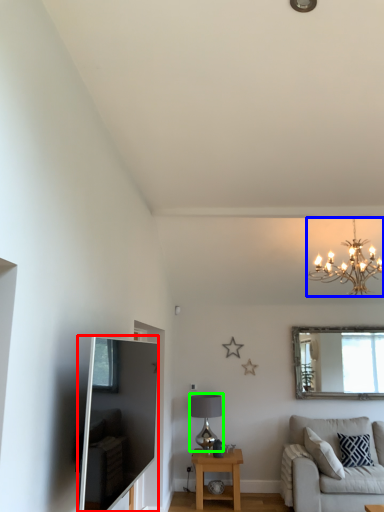
Question: Estimate the real-world distances between objects in this image. Which object is closer to entertainment center (highlighted by a red box), light fixture (highlighted by a blue box) or lamp (highlighted by a green box)?

Choices:
 (A) light fixture
 (B) lamp

Answer: (A)